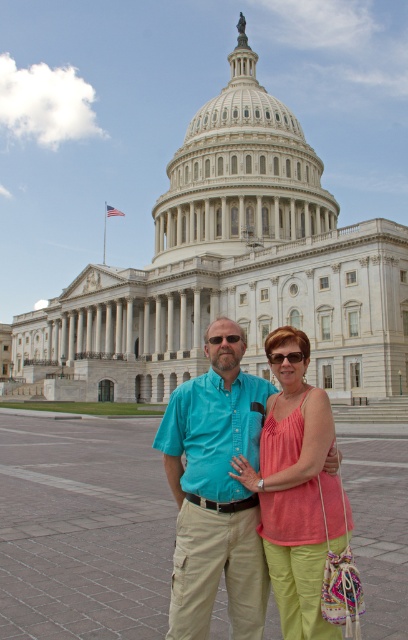
Question: Which of the following is the farthest from the observer?

Choices:
 (A) matte black sunglasses at center
 (B) matte pink tank top at center

Answer: (A)

Question: Does matte pink tank top at center have a lesser width compared to matte black sunglasses at center?

Choices:
 (A) yes
 (B) no

Answer: (B)

Question: Does matte pink tank top at center lie in front of matte black sunglasses at center?

Choices:
 (A) yes
 (B) no

Answer: (A)

Question: Is matte pink tank top at center below matte black sunglasses at center?

Choices:
 (A) no
 (B) yes

Answer: (B)

Question: Among these points, which one is farthest from the camera?

Choices:
 (A) (281, 561)
 (B) (283, 353)

Answer: (B)